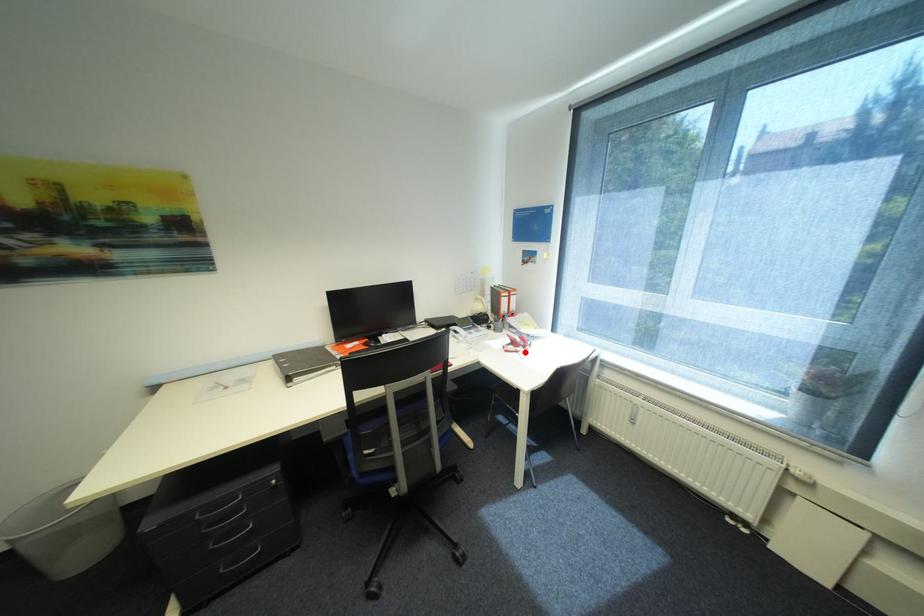
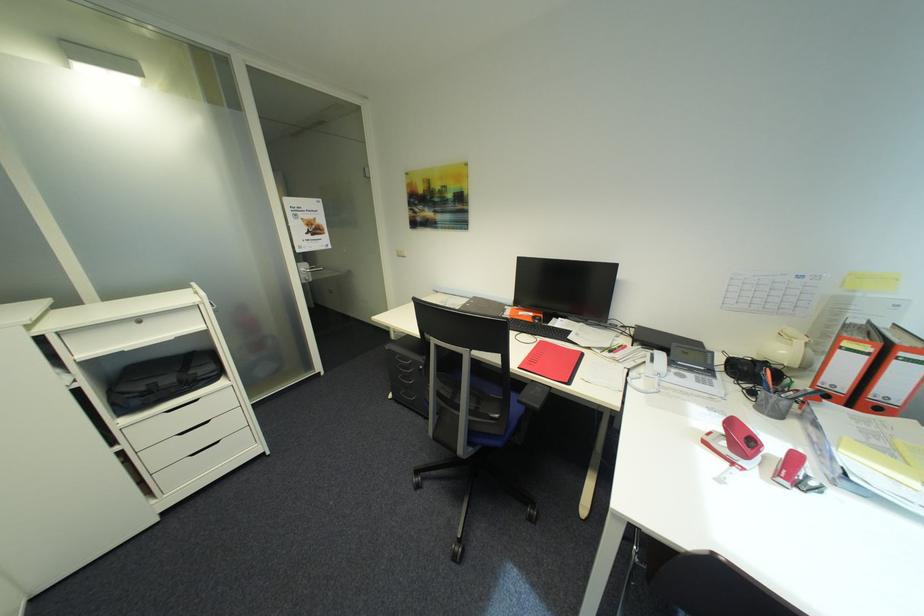
The point at the highlighted location is marked in the first image. Where is the corresponding point in the second image?

(742, 464)